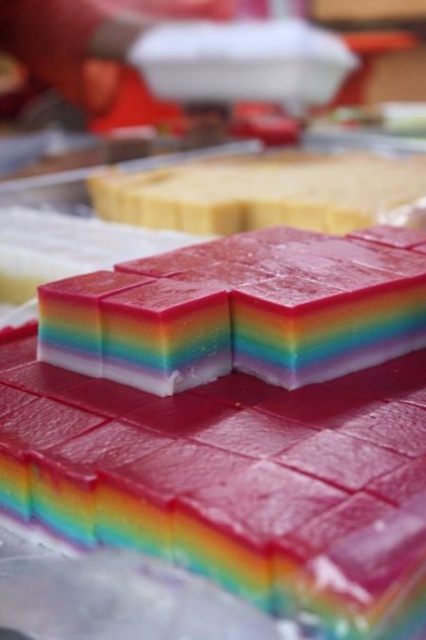
Question: Which point is closer to the camera?

Choices:
 (A) rainbow gelatin at center
 (B) rainbow gelatin cube at center

Answer: (B)

Question: Which of the following is the farthest from the observer?

Choices:
 (A) rainbow gelatin at center
 (B) rainbow gelatin cube at center

Answer: (A)

Question: Which of the following is the farthest from the observer?

Choices:
 (A) rainbow gelatin at center
 (B) rainbow gelatin cube at center

Answer: (A)

Question: Does rainbow gelatin cube at center have a larger size compared to rainbow gelatin at center?

Choices:
 (A) yes
 (B) no

Answer: (A)

Question: Can you confirm if rainbow gelatin cube at center is wider than rainbow gelatin at center?

Choices:
 (A) no
 (B) yes

Answer: (B)

Question: In this image, where is rainbow gelatin cube at center located relative to rainbow gelatin at center?

Choices:
 (A) below
 (B) above

Answer: (A)